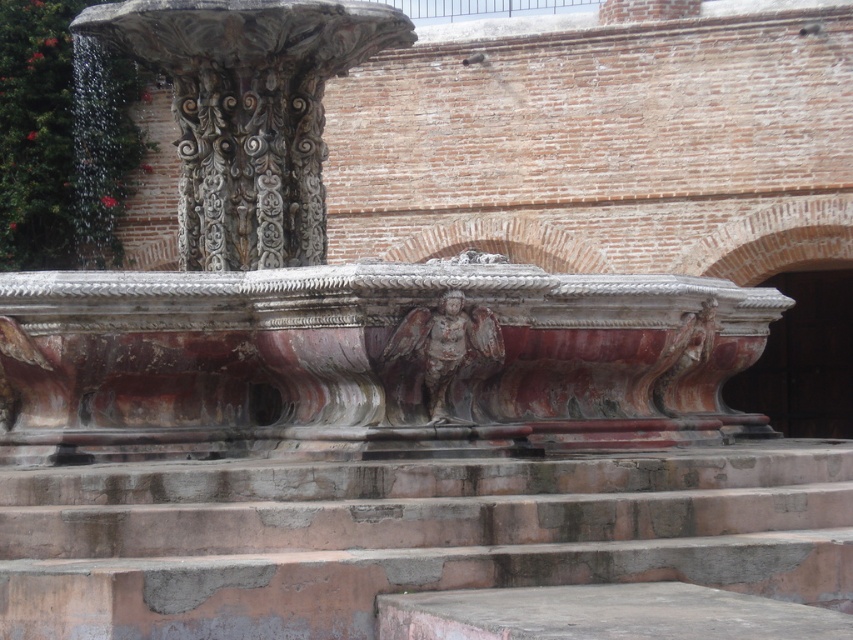
Does point (608, 502) come closer to viewer compared to point (416, 308)?

That is True.

Can you confirm if rustic stone stairs at center is positioned above rustic stone angel at center?

No.

Is point (154, 589) closer to viewer compared to point (386, 356)?

That is True.

Find the location of a particular element. rustic stone stairs at center is located at coordinates (407, 536).

Is marble fountain at center behind carved stone column at upper left?

No, marble fountain at center is in front of carved stone column at upper left.

Is point (277, 19) closer to viewer compared to point (138, 48)?

Yes, it is in front of point (138, 48).

Where is `marble fountain at center`? The width and height of the screenshot is (853, 640). marble fountain at center is located at coordinates (331, 292).

Who is higher up, rustic stone stairs at center or carved stone column at upper left?

carved stone column at upper left is higher up.

Describe the element at coordinates (407, 536) in the screenshot. I see `rustic stone stairs at center` at that location.

You are a GUI agent. You are given a task and a screenshot of the screen. Output one action in this format:
    pyautogui.click(x=<x>, y=<y>)
    Task: Click on the rustic stone stairs at center
    The image size is (853, 640).
    Given the screenshot: What is the action you would take?
    pyautogui.click(x=407, y=536)